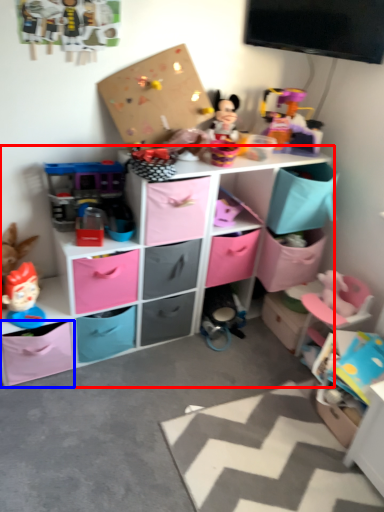
Question: Which object is closer to the camera taking this photo, shelf (highlighted by a red box) or storage box (highlighted by a blue box)?

Choices:
 (A) shelf
 (B) storage box

Answer: (A)